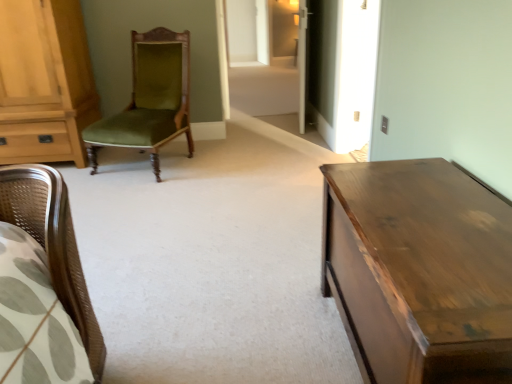
Where is `unoccupied area in front of green velvet chair at center`? This screenshot has height=384, width=512. unoccupied area in front of green velvet chair at center is located at coordinates (155, 193).